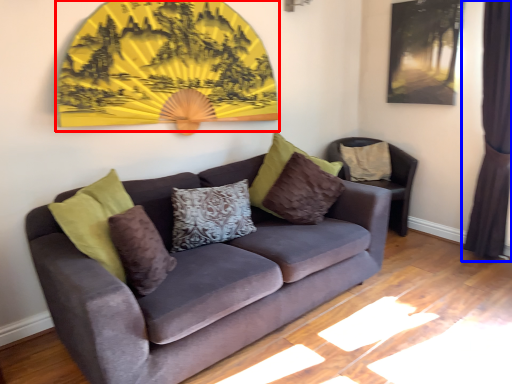
Question: Among these objects, which one is nearest to the camera, decor (highlighted by a red box) or curtain (highlighted by a blue box)?

Choices:
 (A) decor
 (B) curtain

Answer: (A)